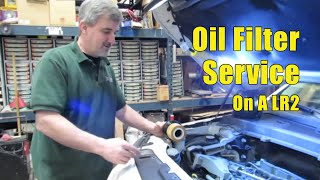
At what (x,y) coordinates should I click in order to perform the action: click on boxes. Please return your answer as a coordinate pair (x, y). This screenshot has width=320, height=180. Looking at the image, I should click on (61, 12), (34, 15).